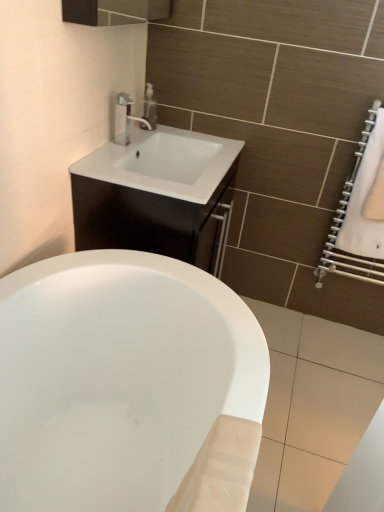
This screenshot has height=512, width=384. Identify the location of free location in front of satin nickel faucet at upper center. (114, 162).